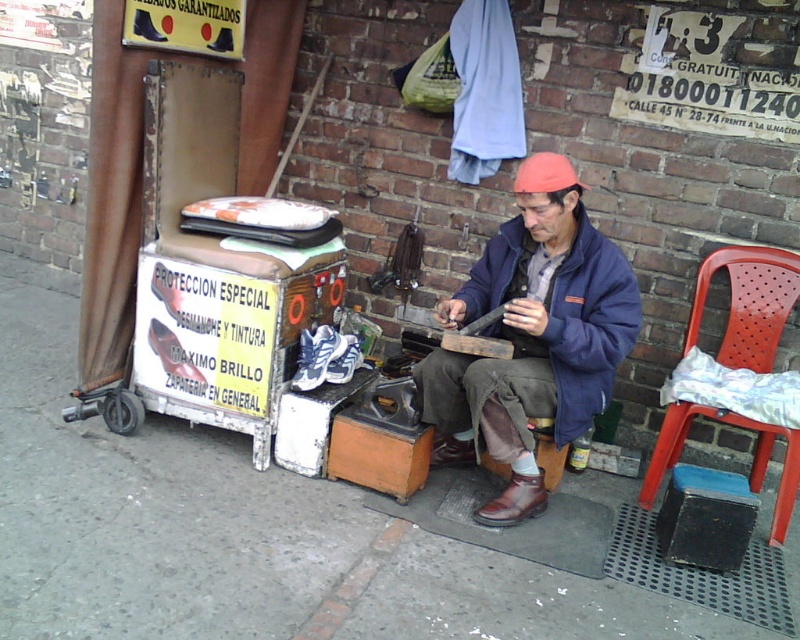
Question: Does white leather shoe at center have a larger size compared to brown leather shoe at center?

Choices:
 (A) yes
 (B) no

Answer: (A)

Question: Which object is farther from the camera taking this photo?

Choices:
 (A) shiny brown leather shoe at lower center
 (B) red plastic chair at right
 (C) smooth concrete pavement at center

Answer: (B)

Question: Is navy blue jacket at center in front of red plastic chair at right?

Choices:
 (A) no
 (B) yes

Answer: (B)

Question: Can you confirm if shiny brown leather shoe at lower center is positioned below white leather shoe at center?

Choices:
 (A) no
 (B) yes

Answer: (B)

Question: Which point is closer to the camera?

Choices:
 (A) red plastic chair at right
 (B) shiny brown leather shoe at lower center
 (C) navy blue jacket at center
 (D) brown leather shoe at center

Answer: (C)

Question: Which point is farther to the camera?

Choices:
 (A) (544, 492)
 (B) (316, 380)

Answer: (B)